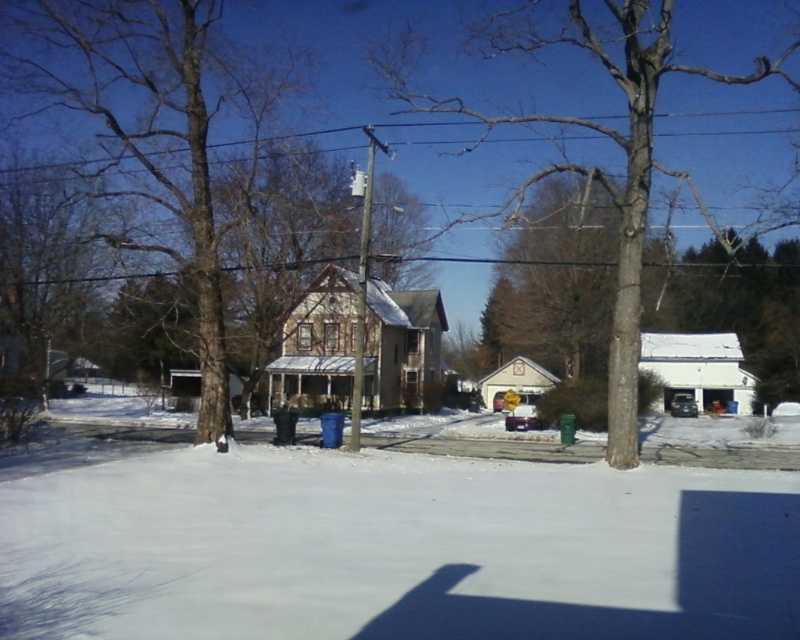
Question: Can you confirm if brown rough tree at center is smaller than brown textured tree at center?

Choices:
 (A) no
 (B) yes

Answer: (B)

Question: Can you confirm if white powdery snow at center is thinner than brown textured tree at center?

Choices:
 (A) no
 (B) yes

Answer: (B)

Question: Among these points, which one is nearest to the camera?

Choices:
 (A) (328, 132)
 (B) (717, 538)
 (C) (352, 392)
 (D) (202, 394)

Answer: (B)

Question: Which object is closer to the camera taking this photo?

Choices:
 (A) white powdery snow at center
 (B) brown textured tree at center
 (C) black wire at upper center

Answer: (A)

Question: Which point is closer to the camera?

Choices:
 (A) (629, 268)
 (B) (364, 317)
 (C) (664, 536)
 (D) (188, 72)

Answer: (C)

Question: Is black wire at upper center to the right of white plastic utility pole at center from the viewer's perspective?

Choices:
 (A) yes
 (B) no

Answer: (A)